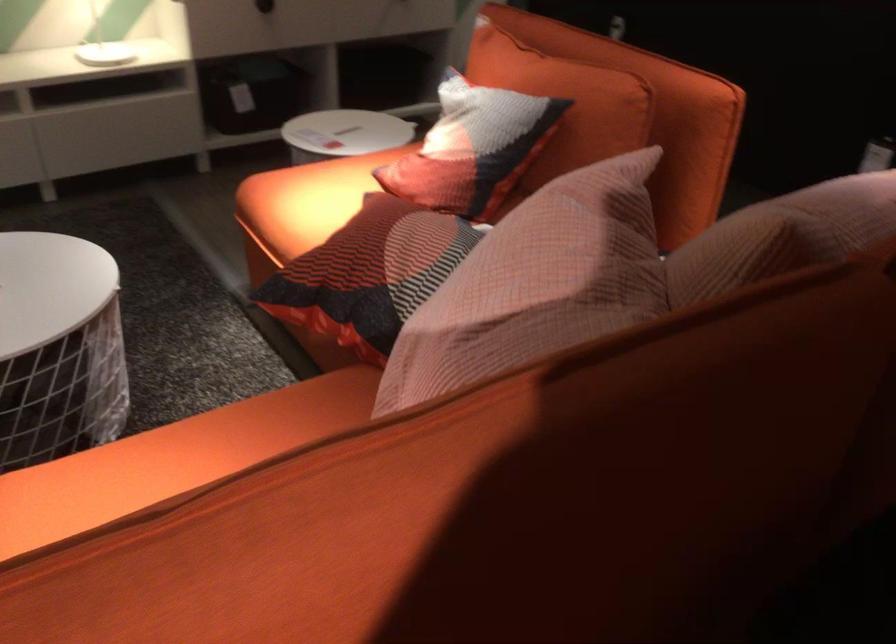
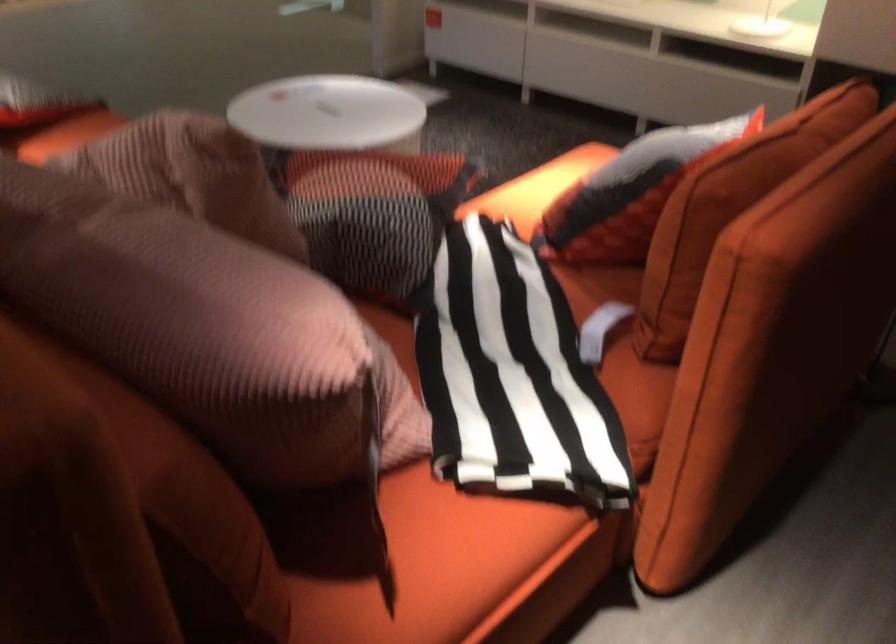
Locate, in the second image, the point that corresponds to (x=670, y=99) in the first image.

(730, 207)